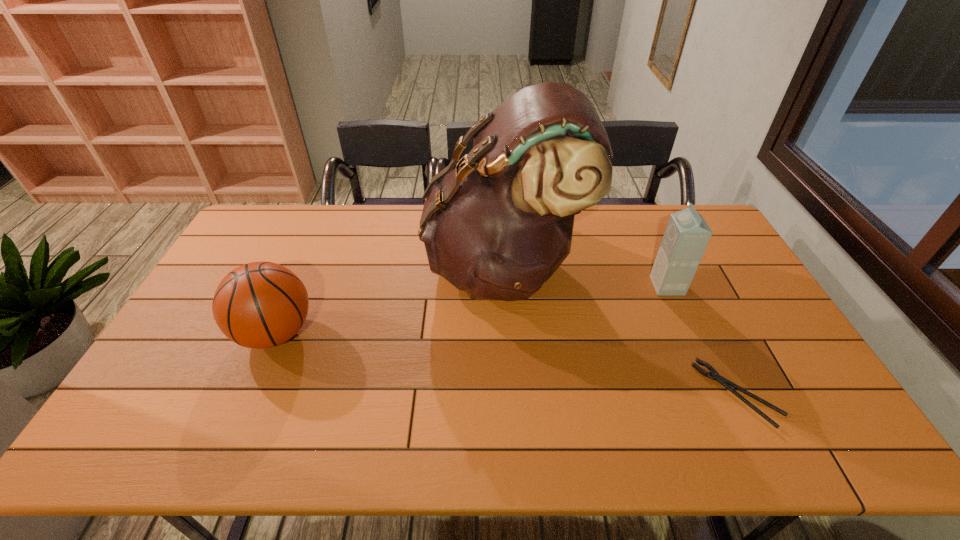
You are a GUI agent. You are given a task and a screenshot of the screen. Output one action in this format:
    pyautogui.click(x=<x>, y=<y>)
    Task: Click on the tallest object
    Image resolution: width=960 pixels, height=540 pixels.
    Given the screenshot: What is the action you would take?
    pyautogui.click(x=497, y=224)

Locate an element on the screen. the second object from left to right is located at coordinates [x=497, y=224].

The image size is (960, 540). In order to click on the second tallest object in this screenshot , I will do `click(687, 234)`.

You are a GUI agent. You are given a task and a screenshot of the screen. Output one action in this format:
    pyautogui.click(x=<x>, y=<y>)
    Task: Click on the leftmost object
    This screenshot has width=960, height=540.
    Given the screenshot: What is the action you would take?
    pyautogui.click(x=258, y=305)

This screenshot has height=540, width=960. In order to click on basketball in this screenshot , I will do `click(258, 305)`.

Identify the location of tongs. (714, 375).

In order to click on free region located at the front of the third object from right to left with buckles in this screenshot , I will do 335,266.

The image size is (960, 540). Find the location of `free space located at the front of the third object from right to left with buckles`. free space located at the front of the third object from right to left with buckles is located at coordinates (335, 266).

Where is `free region located 0.240m at the front of the third object from right to left with buckles`? The height and width of the screenshot is (540, 960). free region located 0.240m at the front of the third object from right to left with buckles is located at coordinates (353, 266).

I want to click on free region located 0.150m on the front label of the carton, so click(606, 286).